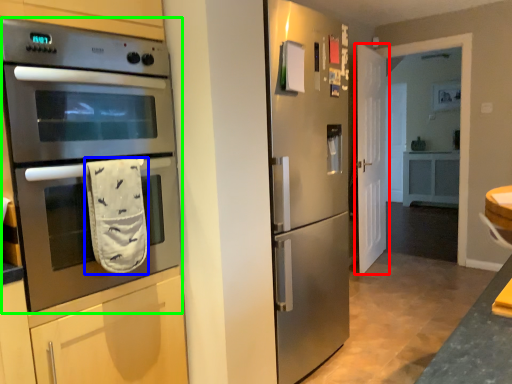
Question: Based on their relative distances, which object is farther from door (highlighted by a red box)? Choose from hand towel (highlighted by a blue box) and microwave oven (highlighted by a green box).

Choices:
 (A) hand towel
 (B) microwave oven

Answer: (A)